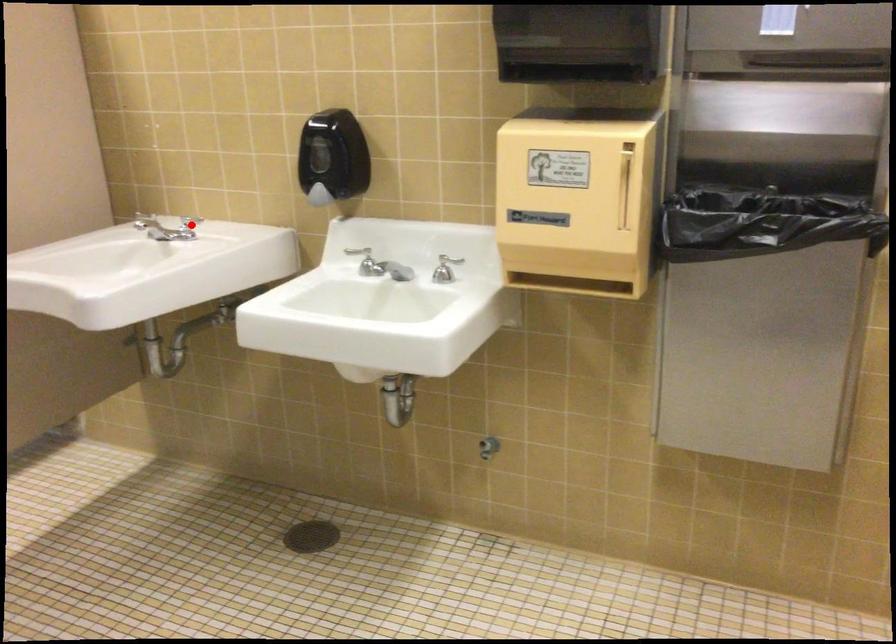
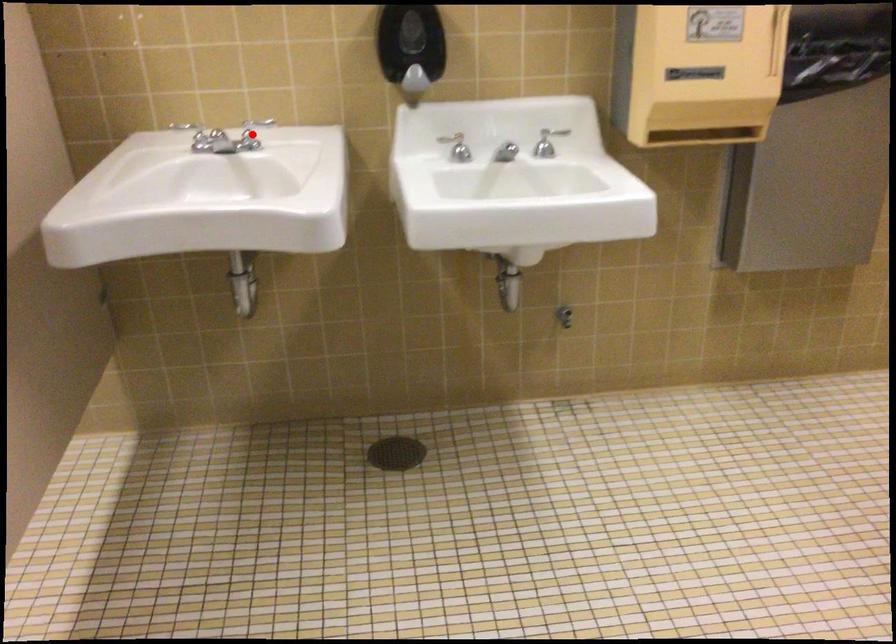
I am providing you with two images of the same scene from different viewpoints. A red point is marked on the first image and another point is marked on the second image. Is the marked point in image1 the same physical position as the marked point in image2?

No